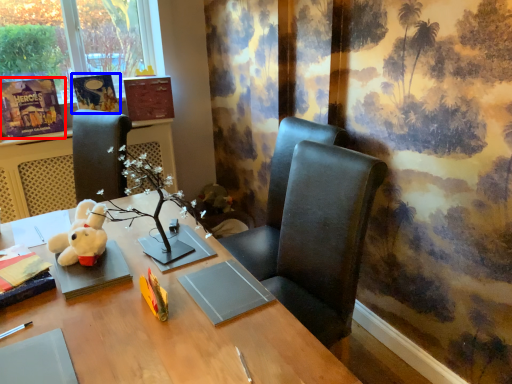
Question: Among these objects, which one is farthest to the camera, book (highlighted by a red box) or book (highlighted by a blue box)?

Choices:
 (A) book
 (B) book

Answer: (B)